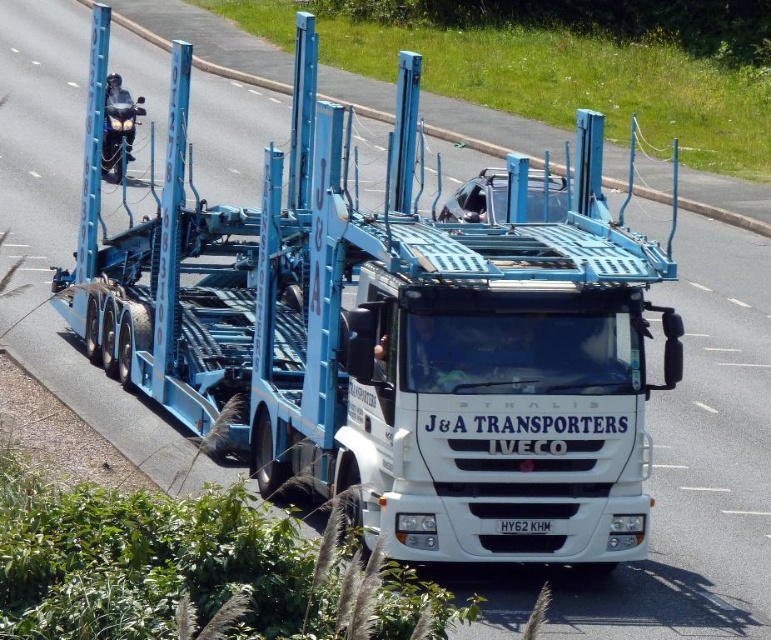
You are a delivery driver who needs to pass a narrow bridge that can only accommodate vehicles up to the width of the shiny chrome motorcycle at left. Can your white matte trailer truck at center safely pass through the bridge?

The white matte trailer truck at center is wider than the shiny chrome motorcycle at left, so it cannot safely pass through the bridge designed for vehicles up to the motorcycle width.

You are a delivery driver who needs to pass under a low bridge that has a height restriction of 4 meters. You are currently driving the white matte trailer truck at center and see the shiny chrome motorcycle at left on the road ahead. Based on their sizes, can you safely pass under the bridge without hitting it?

A: The white matte trailer truck at center is much taller than the shiny chrome motorcycle at left. Since the motorcycle is shorter, it can pass under the bridge, but the truck may not be able to if the bridge is only 4 meters tall. However, without knowing the exact height of the truck, it is impossible to determine if it will fit under the bridge.

You are a delivery driver who needs to unload the white matte trailer truck at center. The unloading zone is located at point (389, 337). Can you confirm if the white matte trailer truck at center is positioned correctly at the unloading zone?

A: The white matte trailer truck at center is located at point (389, 337), so yes, it is positioned correctly at the unloading zone.